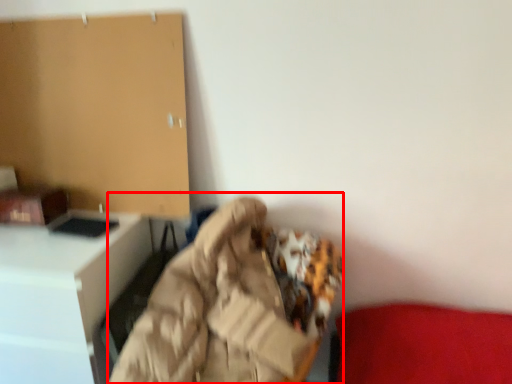
Question: From the image's perspective, what is the correct spatial relationship of bean bag chair (annotated by the red box) in relation to furniture?

Choices:
 (A) below
 (B) above

Answer: (B)